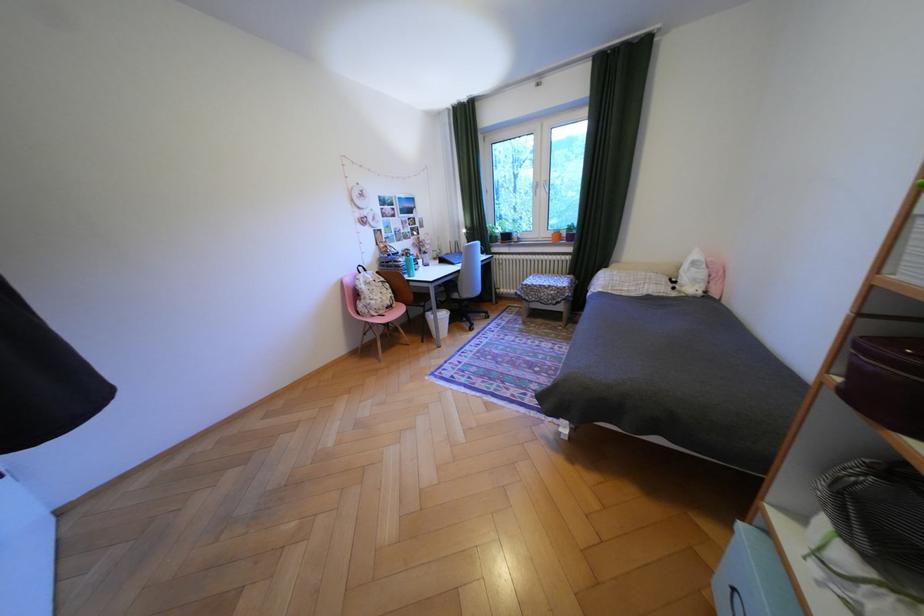
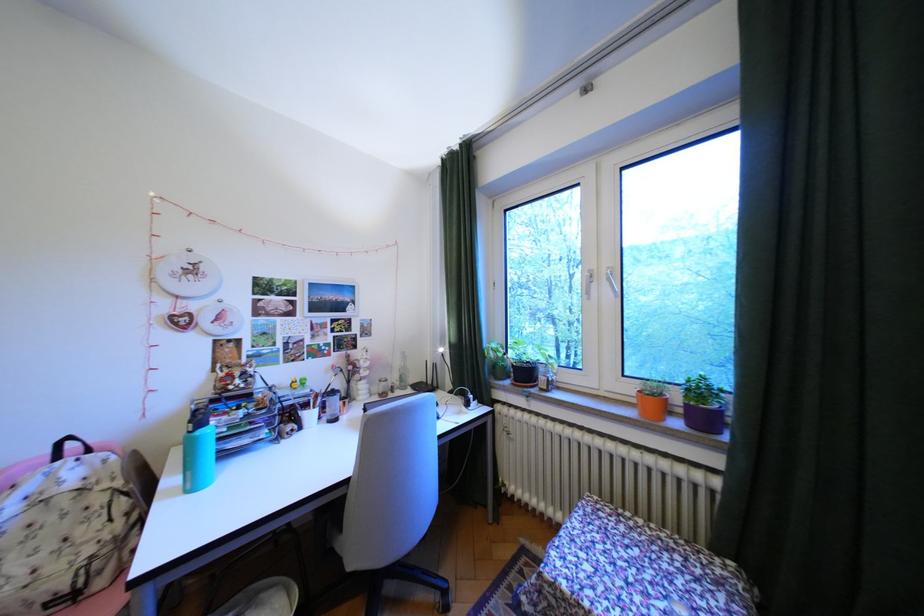
The point at (386,288) is marked in the first image. Where is the corresponding point in the second image?

(65, 519)